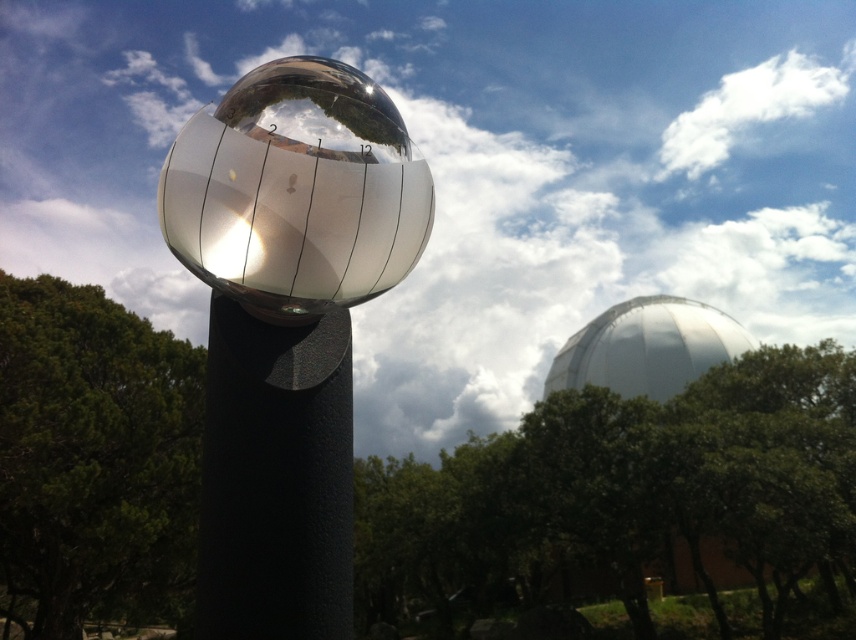
You are an architect designing a garden layout. You need to place a new bench that must be wider than the polished silver sphere at center but narrower than the green leafy tree at center. Is this possible given the current spacing between them?

The polished silver sphere at center has a width less than the green leafy tree at center, so yes, it is possible to place a bench wider than the sphere but narrower than the tree between them.

You are an astronomer trying to align your telescope with the sun. You see the white fluffy cloud at upper center. Based on the sundial in the scene, where is the sun located relative to the cloud?

The white fluffy cloud at upper center is at point (468, 172). Since the sundial shows the sun is in the direction opposite to the shadow cast by its gnomon, the sun would be located in the direction opposite to the shadow. However, without knowing the exact time or the shadow position, we can infer that the cloud is blocking the sun if it is in the path between the observer and the sun. But based on the given coordinates, the sun is likely positioned opposite to the cloud if the cloud is between the sund